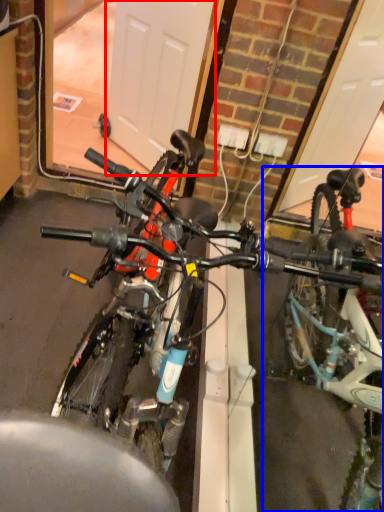
Question: Which of the following is the closest to the observer, garage door (highlighted by a red box) or bicycle (highlighted by a blue box)?

Choices:
 (A) garage door
 (B) bicycle

Answer: (B)